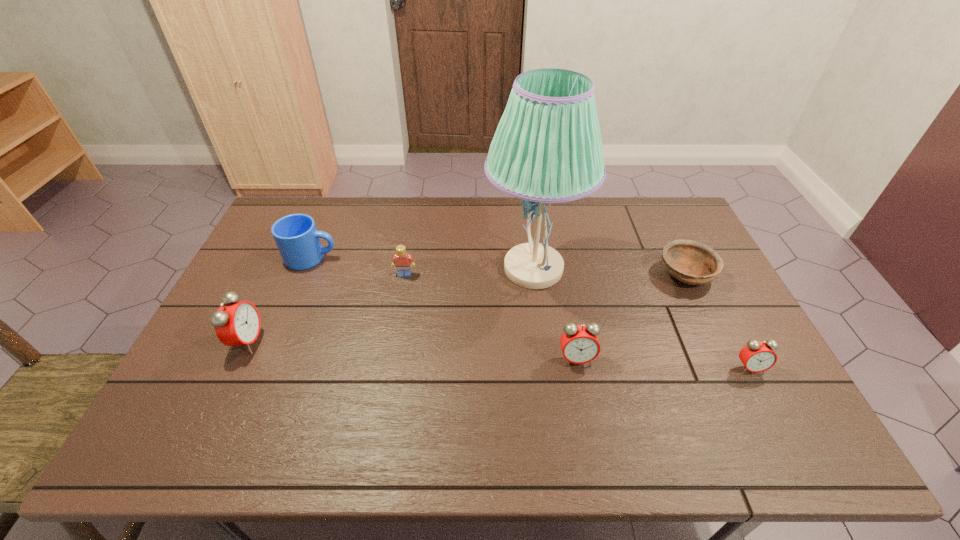
Locate an element on the screen. This screenshot has width=960, height=540. vacant area situated on the front-facing side of the rightmost alarm clock is located at coordinates (762, 394).

At what (x,y) coordinates should I click in order to perform the action: click on vacant space situated 0.230m on the back of the bowl. Please return your answer as a coordinate pair (x, y). This screenshot has width=960, height=540. Looking at the image, I should click on (657, 214).

This screenshot has width=960, height=540. Identify the location of vacant space situated 0.130m on the side of the mug with the handle. (378, 258).

Image resolution: width=960 pixels, height=540 pixels. Identify the location of free space located on the front of the lamp. (543, 347).

Where is `vacant region located 0.050m on the front-facing side of the fifth object from right to left`? vacant region located 0.050m on the front-facing side of the fifth object from right to left is located at coordinates (402, 289).

Find the location of a particular element. Image resolution: width=960 pixels, height=540 pixels. object that is at the far edge is located at coordinates (547, 148).

At what (x,y) coordinates should I click in order to perform the action: click on alarm clock that is at the left edge. Please return your answer as a coordinate pair (x, y). Looking at the image, I should click on (237, 323).

Locate an element on the screen. mug positioned at the left edge is located at coordinates (296, 236).

Where is `alarm clock positioned at the right edge`? This screenshot has width=960, height=540. alarm clock positioned at the right edge is located at coordinates (757, 356).

I want to click on bowl present at the right edge, so click(691, 262).